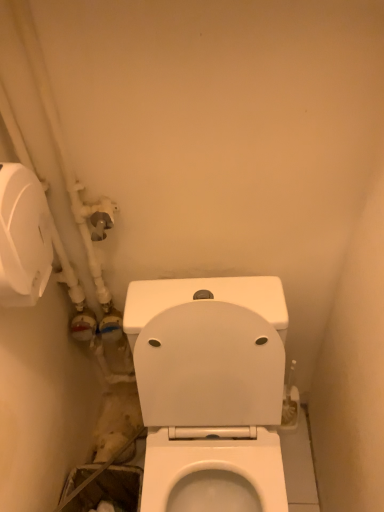
This screenshot has height=512, width=384. What do you see at coordinates (210, 392) in the screenshot?
I see `white glossy toilet at center` at bounding box center [210, 392].

This screenshot has width=384, height=512. I want to click on white glossy toilet at center, so click(x=210, y=392).

Image resolution: width=384 pixels, height=512 pixels. Identify the location of white glossy toilet at center. (210, 392).